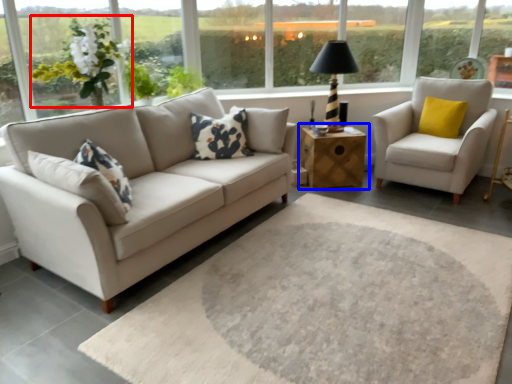
Question: Among these objects, which one is farthest to the camera, flower (highlighted by a red box) or table (highlighted by a blue box)?

Choices:
 (A) flower
 (B) table

Answer: (B)